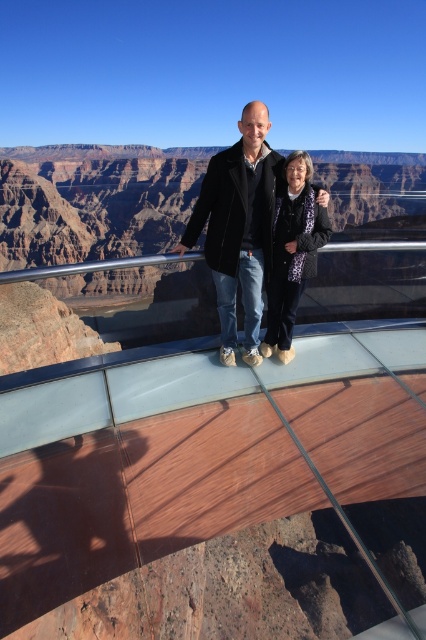
Based on the photo, you are standing at the Skywalk at the Grand Canyon and want to take a photo of the matte black coat at center. Where should you position yourself to capture it in the frame?

You should position yourself at point (238,227) to capture the matte black coat at center in the frame.

You are standing at point (241, 176) on the Skywalk. The man is to your left and the woman is to your right. If you want to take a photo of both of them in the frame, should you move closer to the man or the woman?

You should move closer to the woman because they are 82.62 feet apart, so moving towards the woman will help include both in the frame.